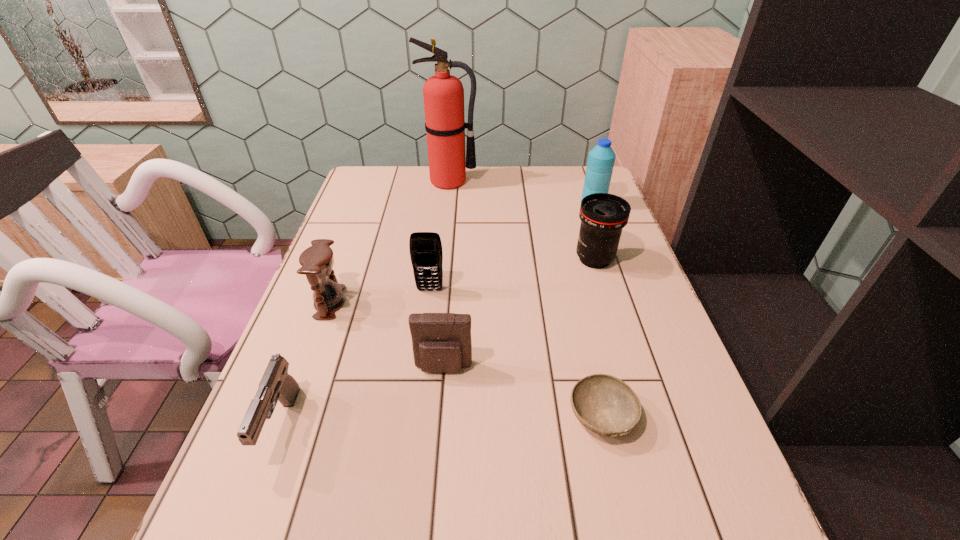
You are a GUI agent. You are given a task and a screenshot of the screen. Output one action in this format:
    pyautogui.click(x=<x>, y=<y>)
    Task: Click on the farthest object
    
    Given the screenshot: What is the action you would take?
    pyautogui.click(x=443, y=94)

Identify the location of the tallest object. The width and height of the screenshot is (960, 540). (443, 94).

At what (x,y) coordinates should I click in order to perform the action: click on water bottle. Please return your answer as a coordinate pair (x, y). The height and width of the screenshot is (540, 960). Looking at the image, I should click on (601, 159).

What are the coordinates of `the second tallest object` in the screenshot? It's located at (601, 159).

Where is `cellular telephone`? cellular telephone is located at coordinates (426, 253).

Where is `telephoto lens`? telephoto lens is located at coordinates (603, 216).

This screenshot has height=540, width=960. What are the coordinates of `hourglass` in the screenshot? It's located at (317, 261).

Find the location of a particular element. The image size is (960, 540). the sixth farthest object is located at coordinates (441, 342).

The image size is (960, 540). I want to click on pistol, so click(276, 384).

You are a GUI agent. You are given a task and a screenshot of the screen. Output one action in this format:
    pyautogui.click(x=<x>, y=<y>)
    Task: Click on the shortest object
    Image resolution: width=960 pixels, height=540 pixels.
    Given the screenshot: What is the action you would take?
    pyautogui.click(x=606, y=405)